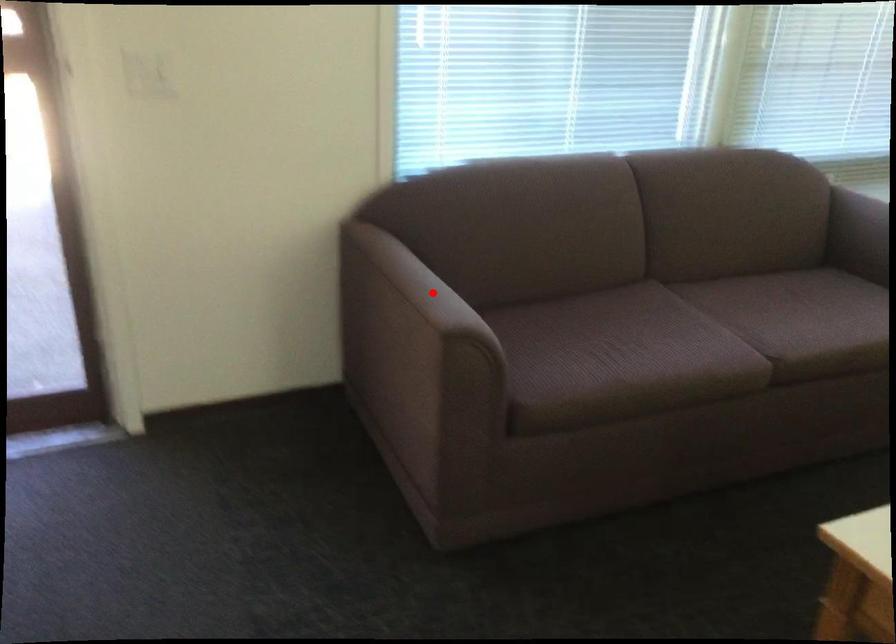
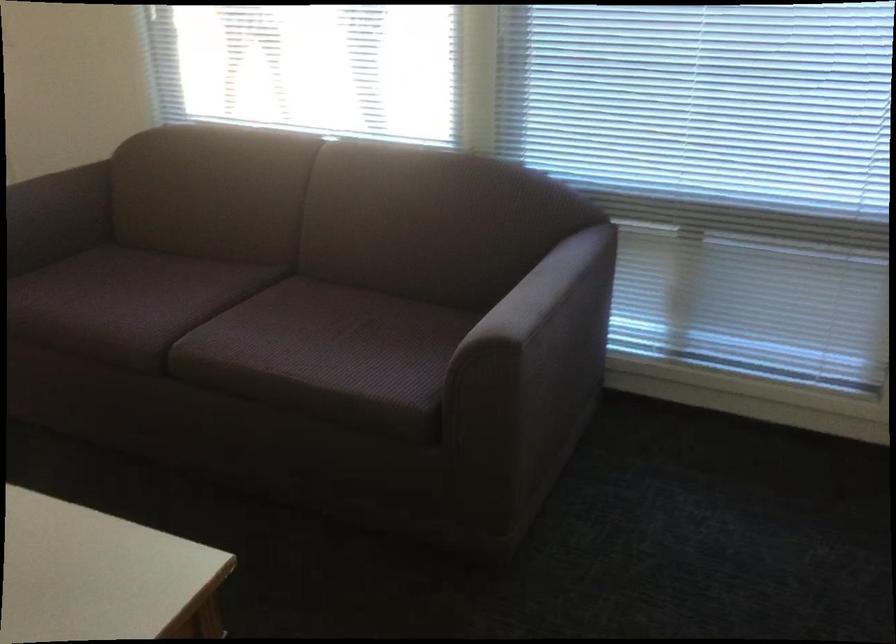
Find the pixel in the second image that matches the highlighted location in the first image.

(56, 216)